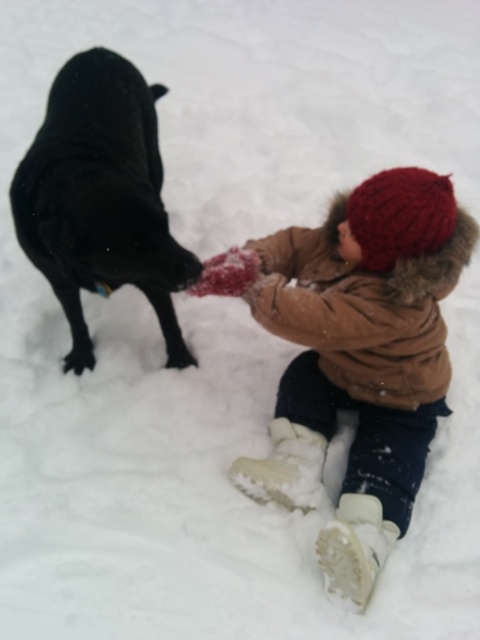
Question: From the image, what is the correct spatial relationship of knitted woolen hat at upper center in relation to shiny black dog at upper left?

Choices:
 (A) right
 (B) left

Answer: (A)

Question: Which of the following is the closest to the observer?

Choices:
 (A) (308, 387)
 (B) (94, 193)

Answer: (B)

Question: Is knitted woolen hat at upper center closer to the viewer compared to shiny black dog at upper left?

Choices:
 (A) yes
 (B) no

Answer: (A)

Question: Can you confirm if knitted woolen hat at upper center is bigger than shiny black dog at upper left?

Choices:
 (A) yes
 (B) no

Answer: (B)

Question: Which object appears farthest from the camera in this image?

Choices:
 (A) knitted woolen hat at upper center
 (B) shiny black dog at upper left

Answer: (B)